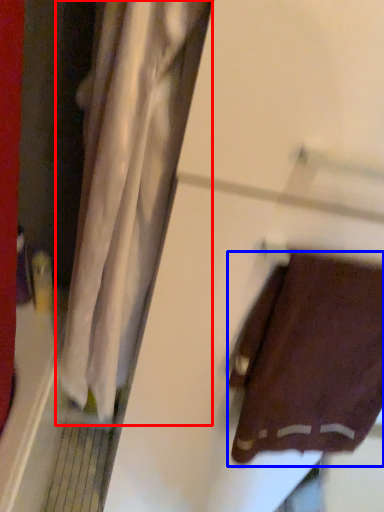
Question: Which point is closer to the camera, curtain (highlighted by a red box) or towel (highlighted by a blue box)?

Choices:
 (A) curtain
 (B) towel

Answer: (A)